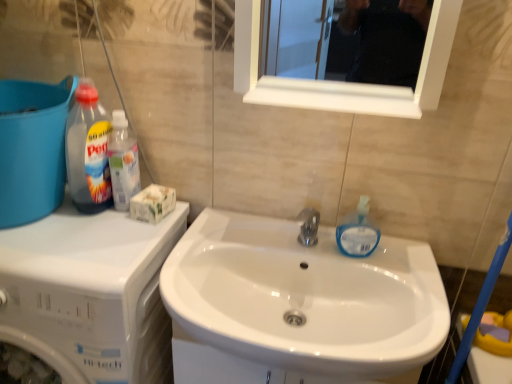
Question: Looking at their shapes, would you say transparent plastic bottle at left, which ranks as the 1th cleaning product in left-to-right order, is wider or thinner than translucent plastic bottle at upper left, the second cleaning product positioned from the right?

Choices:
 (A) thin
 (B) wide

Answer: (B)

Question: Which is correct: transparent plastic bottle at left, acting as the third cleaning product starting from the right, is inside translucent plastic bottle at upper left, the second cleaning product from the left, or outside of it?

Choices:
 (A) inside
 (B) outside

Answer: (B)

Question: Considering the real-world distances, which object is farthest from the white glossy dishwasher at left?

Choices:
 (A) translucent plastic bottle at upper left, the second cleaning product from the left
 (B) white glossy sink at center
 (C) blue plastic bucket at left
 (D) translucent blue liquid soap at sink right, acting as the 3th cleaning product starting from the left
 (E) transparent plastic bottle at left, acting as the third cleaning product starting from the right

Answer: (D)

Question: Which is nearer to the translucent blue liquid soap at sink right, acting as the 3th cleaning product starting from the left?

Choices:
 (A) transparent plastic bottle at left, which ranks as the 1th cleaning product in left-to-right order
 (B) translucent plastic bottle at upper left, the second cleaning product from the left
 (C) white glossy dishwasher at left
 (D) white glossy sink at center
 (E) blue plastic bucket at left

Answer: (D)